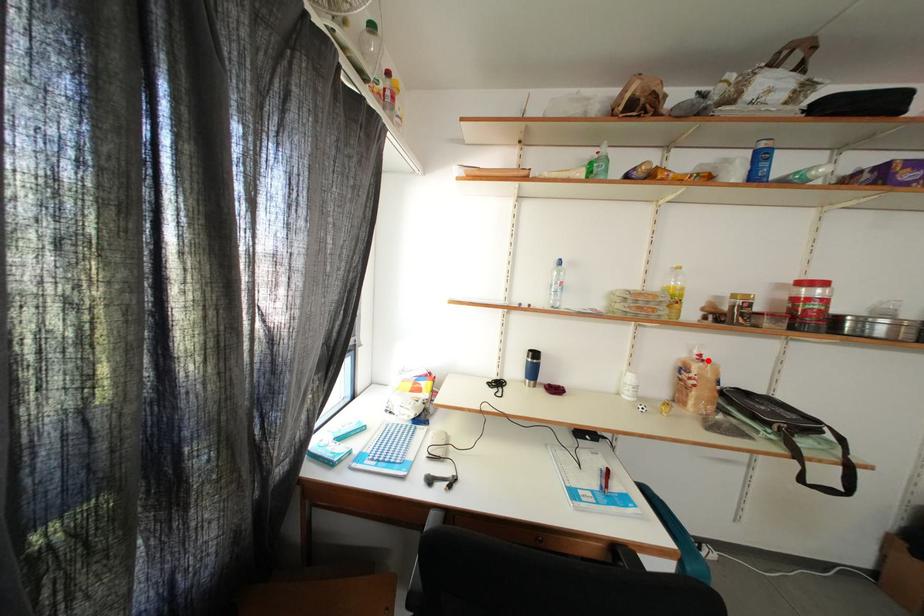
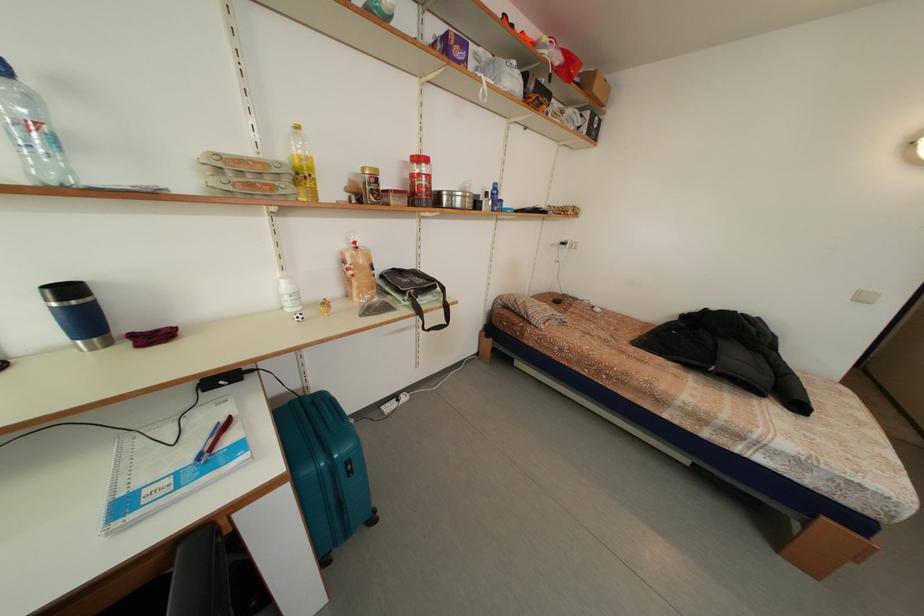
Find the pixel in the second image that matches the highlighted location in the first image.

(362, 248)